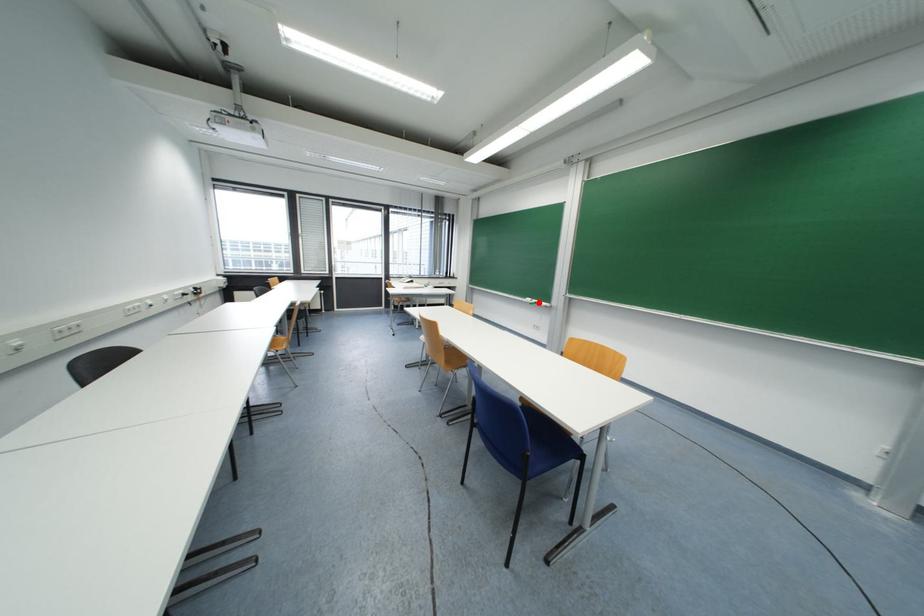
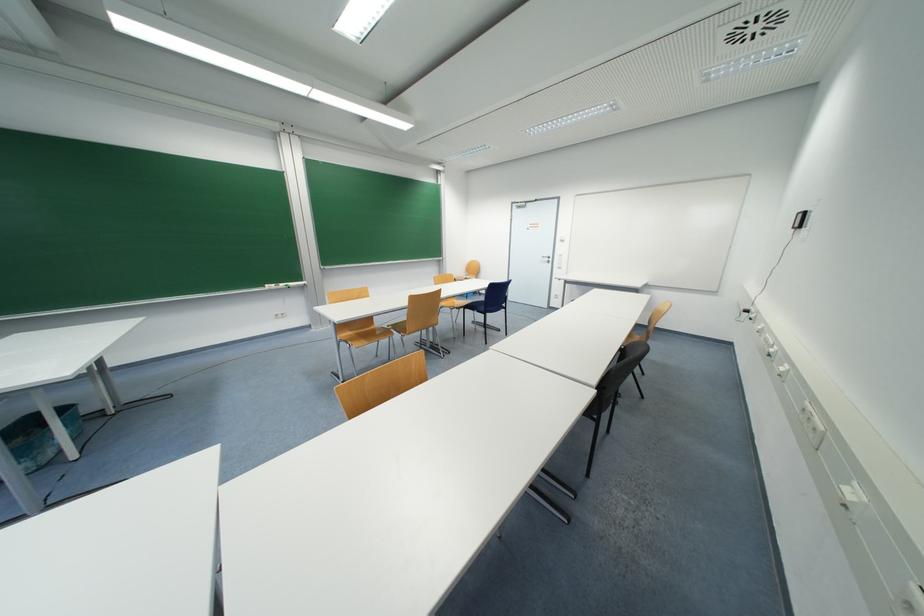
In the second image, find the point that corresponds to the highlighted location in the first image.

(286, 286)